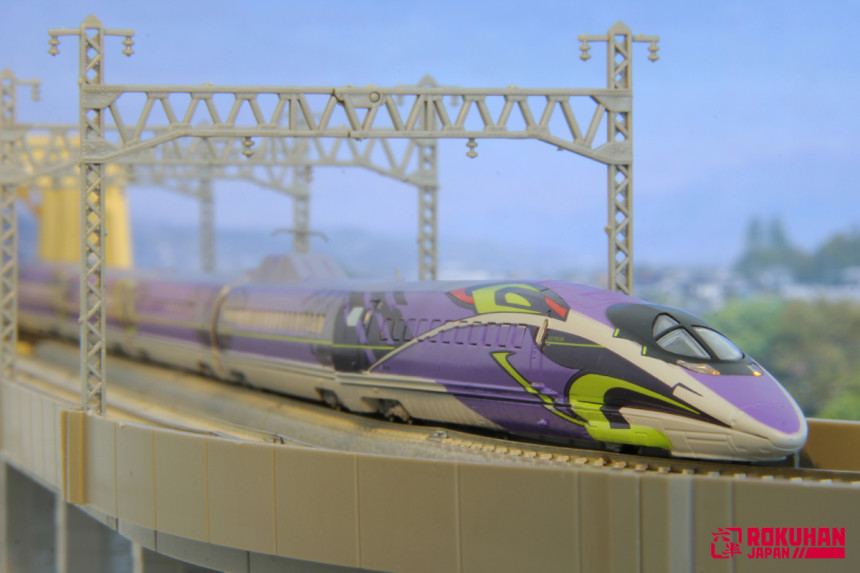
Image resolution: width=860 pixels, height=573 pixels. I want to click on glass, so click(x=685, y=343).